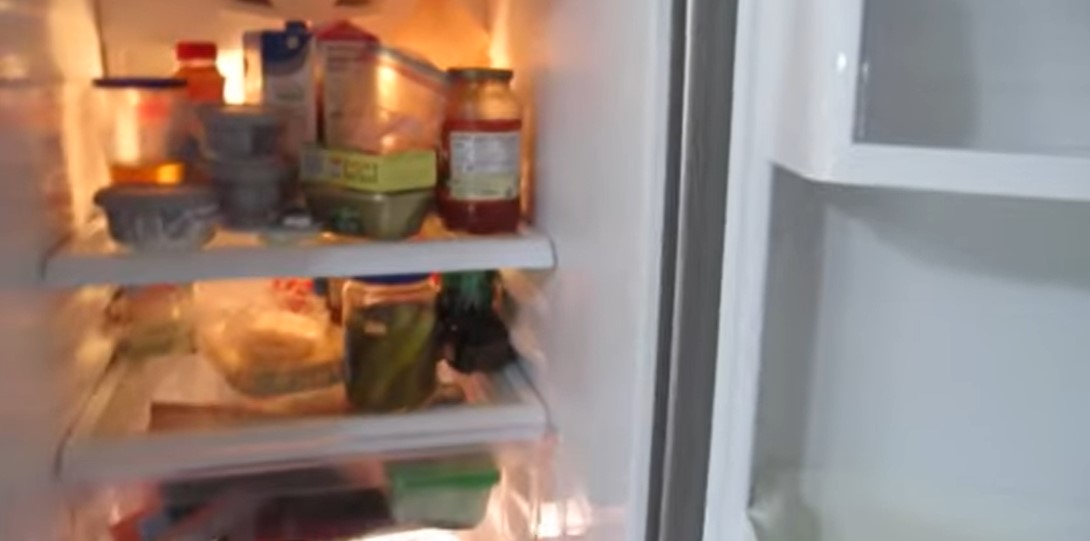
Identify the location of jar of pickles. (400, 338).